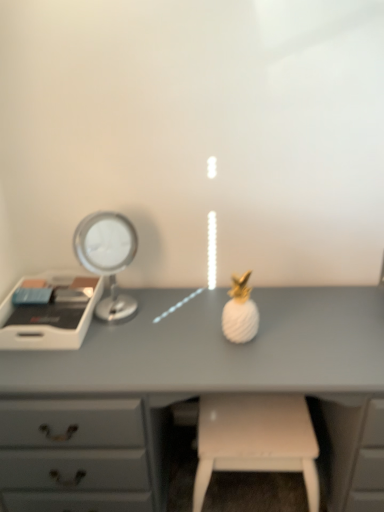
Locate an element on the screen. The height and width of the screenshot is (512, 384). vacant space in front of white plastic tray at left is located at coordinates (55, 365).